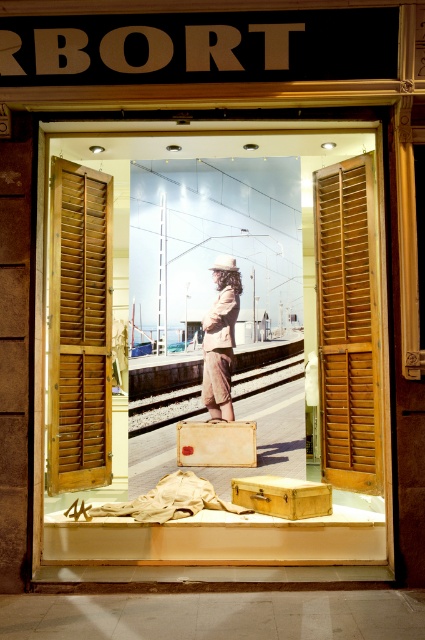
Between point (243, 170) and point (334, 289), which one is positioned in front?

Point (334, 289) is more forward.

From the picture: Does wooden suitcase at center have a lesser width compared to wooden at right?

No, wooden suitcase at center is not thinner than wooden at right.

Who is more distant from viewer, (300, 129) or (368, 262)?

The point (368, 262) is behind.

Find the location of `wooden suitcase at center`. wooden suitcase at center is located at coordinates (201, 324).

How distant is wooden shutters at left from light brown fabric coat at center?

wooden shutters at left is 90.53 centimeters from light brown fabric coat at center.

Is the position of wooden shutters at left more distant than that of light brown fabric coat at center?

No, wooden shutters at left is in front of light brown fabric coat at center.

What do you see at coordinates (79, 328) in the screenshot?
I see `wooden shutters at left` at bounding box center [79, 328].

The height and width of the screenshot is (640, 425). In order to click on wooden shutters at left in this screenshot , I will do `click(79, 328)`.

Who is positioned more to the left, wooden at right or wooden briefcase at center?

wooden briefcase at center

Does wooden at right appear on the right side of wooden briefcase at center?

Yes, wooden at right is to the right of wooden briefcase at center.

Is point (322, 420) farther from viewer compared to point (268, 497)?

Yes, point (322, 420) is farther from viewer.

The image size is (425, 640). Find the location of `wooden at right`. wooden at right is located at coordinates (348, 324).